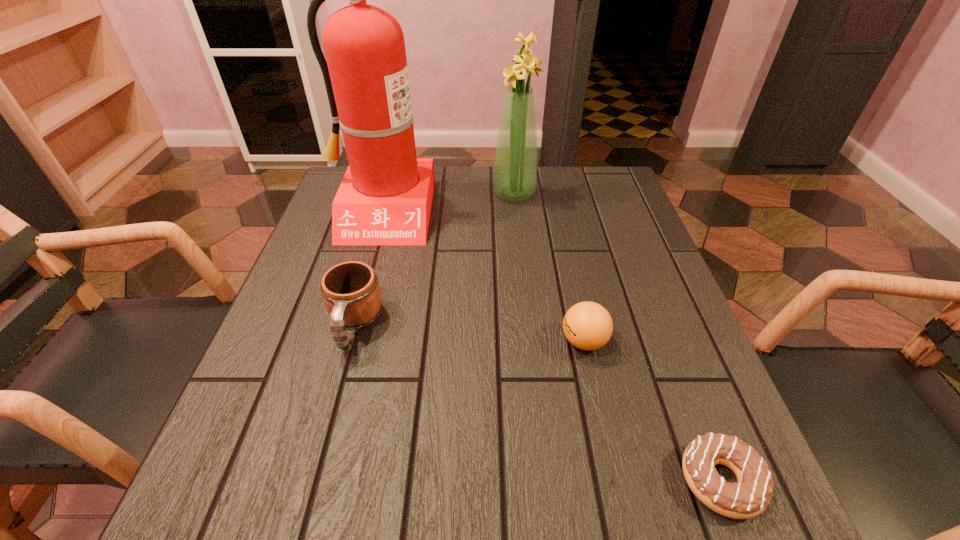
Where is `vacant area that lies between the mug and the second tallest object`? The width and height of the screenshot is (960, 540). vacant area that lies between the mug and the second tallest object is located at coordinates (434, 260).

Find the location of a particular element. vacant area that lies between the doughnut and the second object from right to left is located at coordinates (652, 411).

Where is `empty space that is in between the mug and the third object from left to right`? empty space that is in between the mug and the third object from left to right is located at coordinates (434, 260).

In order to click on vacant space that is in between the second tallest object and the fire extinguisher in this screenshot , I will do `click(448, 202)`.

The width and height of the screenshot is (960, 540). I want to click on vacant space in between the ping-pong ball and the mug, so tap(469, 333).

What are the coordinates of `free space between the third object from left to right and the tallest object` in the screenshot? It's located at (448, 202).

You are a GUI agent. You are given a task and a screenshot of the screen. Output one action in this format:
    pyautogui.click(x=<x>, y=<y>)
    Task: Click on the free space that is in between the bouquet and the doughnut
    This screenshot has height=540, width=960.
    Given the screenshot: What is the action you would take?
    pyautogui.click(x=617, y=338)

What are the coordinates of `free space between the ping-pong ball and the doughnut` in the screenshot? It's located at (652, 411).

In order to click on free space between the fire extinguisher and the third object from left to right in this screenshot , I will do point(448,202).

Image resolution: width=960 pixels, height=540 pixels. In order to click on object that is the fourth nearest to the third object from right to left in this screenshot , I will do `click(750, 496)`.